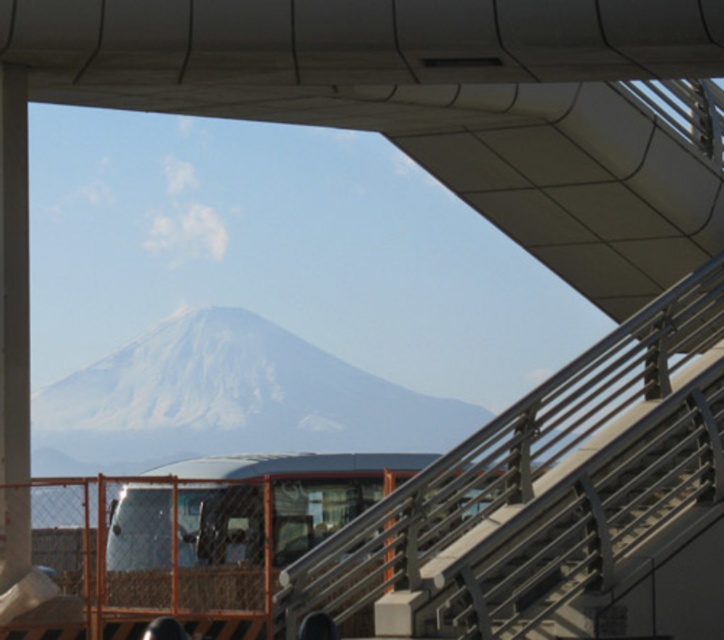
Question: Which point is closer to the camera?

Choices:
 (A) white glossy pillar at left
 (B) white snow-covered mountain at center

Answer: (A)

Question: Can you confirm if white snow-covered mountain at center is smaller than white glossy pillar at left?

Choices:
 (A) no
 (B) yes

Answer: (A)

Question: Does white snow-covered mountain at center have a smaller size compared to white glossy pillar at left?

Choices:
 (A) yes
 (B) no

Answer: (B)

Question: Is white snow-covered mountain at center thinner than white glossy pillar at left?

Choices:
 (A) no
 (B) yes

Answer: (A)

Question: Which object appears farthest from the camera in this image?

Choices:
 (A) white snow-covered mountain at center
 (B) white glossy pillar at left

Answer: (A)

Question: Which point appears closest to the camera in this image?

Choices:
 (A) (104, 387)
 (B) (7, 196)

Answer: (B)